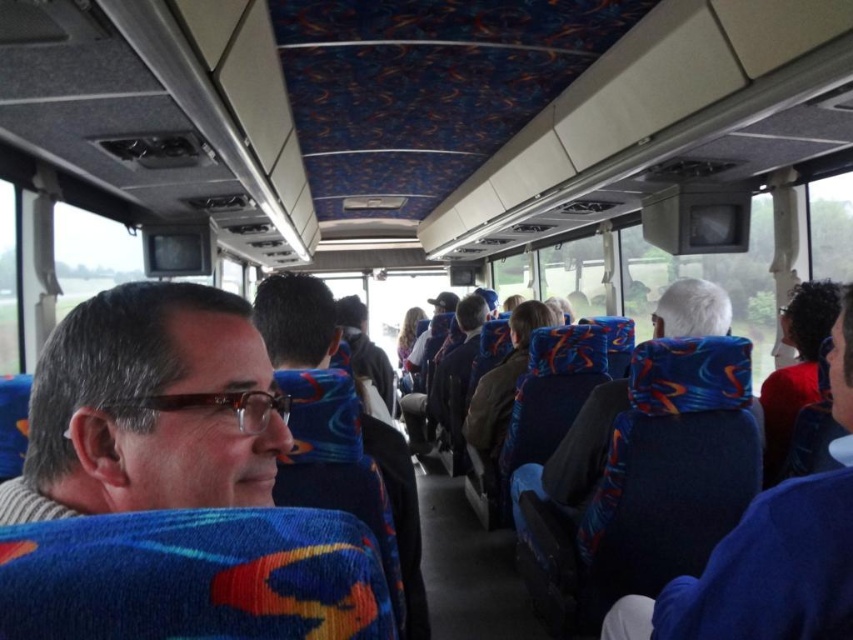
Question: Among these points, which one is nearest to the camera?

Choices:
 (A) [180, 284]
 (B) [370, 428]

Answer: (A)

Question: Can you confirm if matte black glasses at left is thinner than blue fabric headrest at right?

Choices:
 (A) no
 (B) yes

Answer: (B)

Question: Is blue fabric headrest at right below matte blue jacket at center?

Choices:
 (A) no
 (B) yes

Answer: (B)

Question: Can you confirm if matte black glasses at left is positioned below blue fabric headrest at right?

Choices:
 (A) yes
 (B) no

Answer: (B)

Question: Which of the following is the farthest from the observer?

Choices:
 (A) matte black glasses at left
 (B) matte blue jacket at center

Answer: (B)

Question: Which point is farther from the camera taking this photo?

Choices:
 (A) (204, 488)
 (B) (328, 324)
 (C) (827, 522)

Answer: (B)